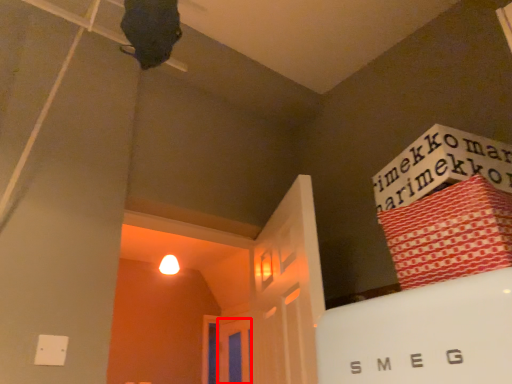
Question: Where is door (annotated by the red box) located in relation to bundle in the image?

Choices:
 (A) right
 (B) left

Answer: (B)